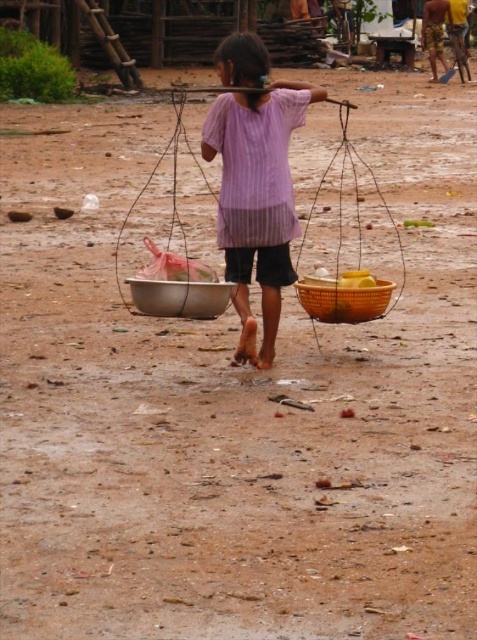
Looking at this image, measure the distance between bright yellow woven basket at center and brown hair at center.

bright yellow woven basket at center is 1.79 meters away from brown hair at center.

Consider the image. Does bright yellow woven basket at center appear under brown hair at center?

Indeed, bright yellow woven basket at center is positioned under brown hair at center.

Where is `bright yellow woven basket at center`? bright yellow woven basket at center is located at coordinates (343, 300).

Can you confirm if bright yellow woven basket at center is bigger than metallic silver bowl at center?

Yes, bright yellow woven basket at center is bigger than metallic silver bowl at center.

This screenshot has width=477, height=640. What are the coordinates of `bright yellow woven basket at center` in the screenshot? It's located at (343, 300).

Does purple striped shirt at center have a lesser width compared to bright yellow woven basket at center?

Incorrect, purple striped shirt at center's width is not less than bright yellow woven basket at center's.

Is purple striped shirt at center smaller than bright yellow woven basket at center?

Actually, purple striped shirt at center might be larger than bright yellow woven basket at center.

Between point (231, 234) and point (330, 316), which one is positioned behind?

The point (330, 316) is behind.

Find the location of `purple striped shirt at center`. purple striped shirt at center is located at coordinates (257, 198).